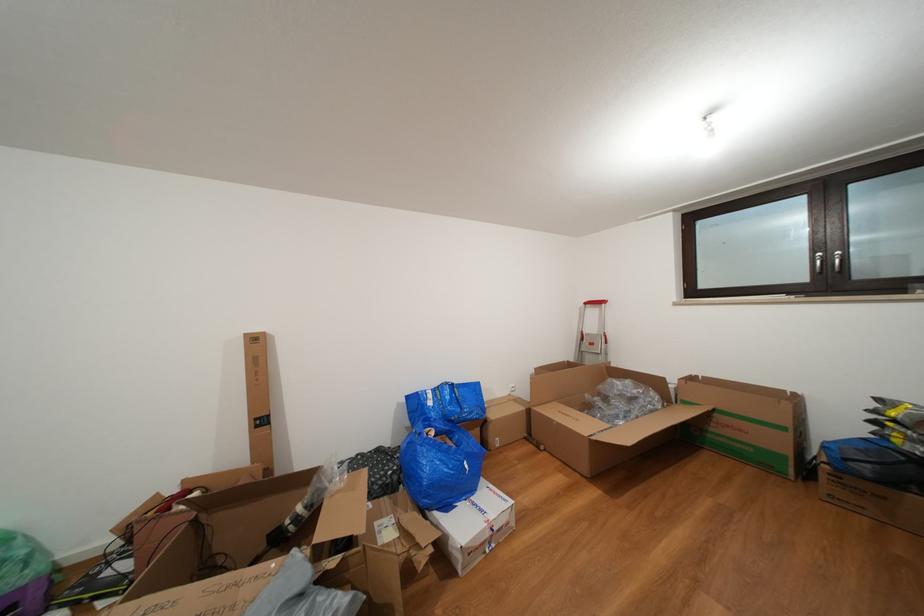
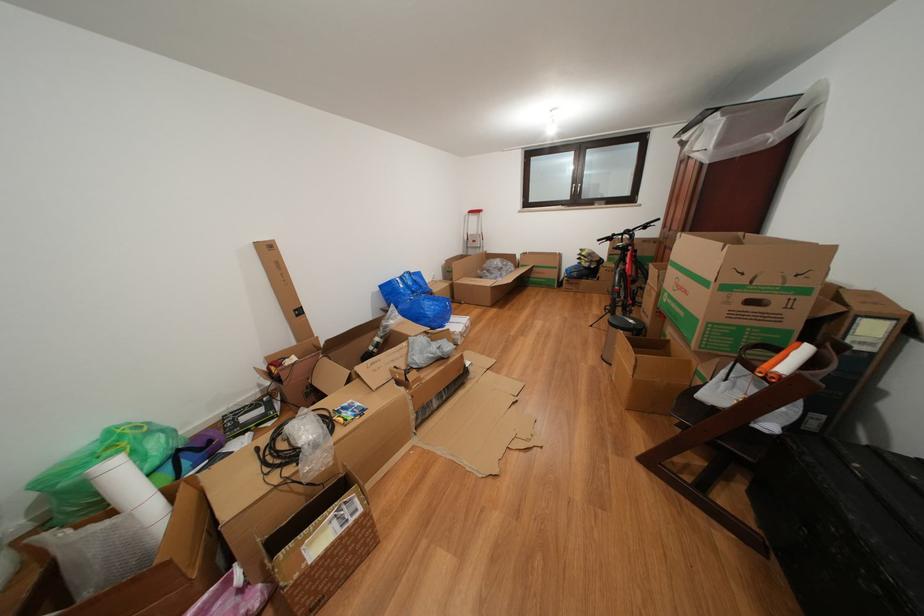
In the second image, find the point that corresponds to [643,418] in the first image.

(513, 280)